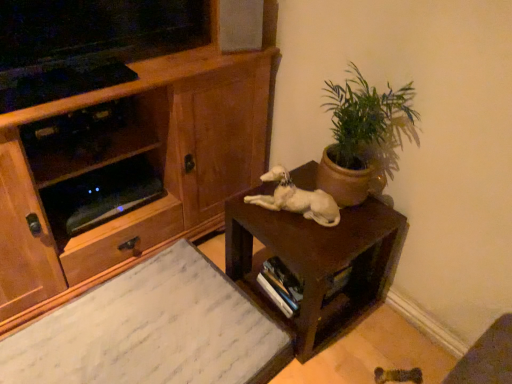
Locate an element on the screen. vacant area that is in front of white glossy dog at center is located at coordinates (298, 232).